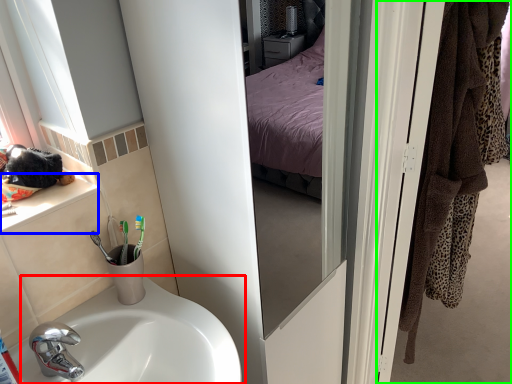
Question: Considering the real-world distances, which object is farthest from sink (highlighted by a red box)? window sill (highlighted by a blue box) or door (highlighted by a green box)?

Choices:
 (A) window sill
 (B) door

Answer: (B)